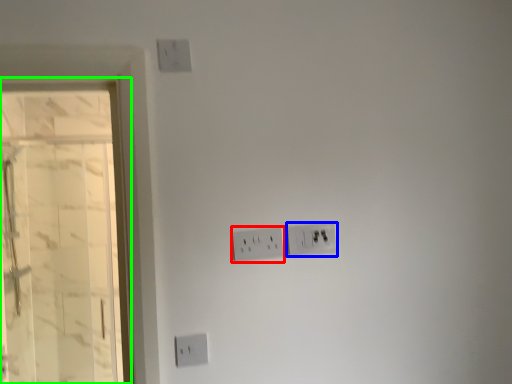
Question: Based on their relative distances, which object is nearer to power plugs and sockets (highlighted by a red box)? Choose from power plugs and sockets (highlighted by a blue box) and glass door (highlighted by a green box).

Choices:
 (A) power plugs and sockets
 (B) glass door

Answer: (A)